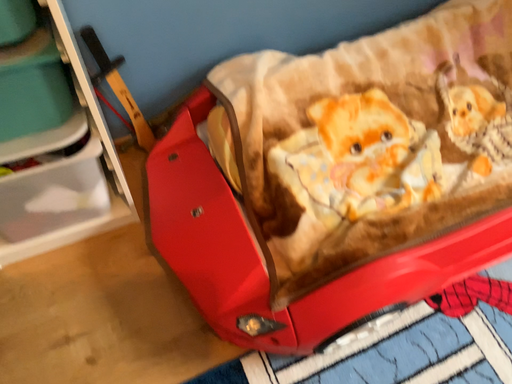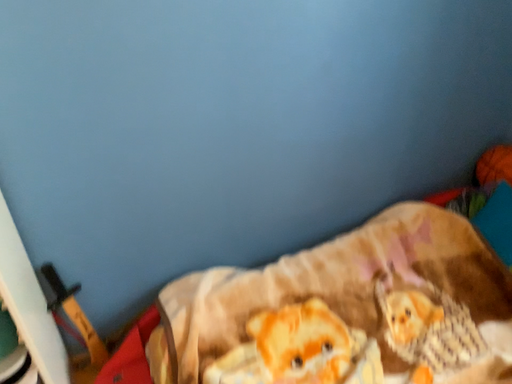
Question: How did the camera likely rotate when shooting the video?

Choices:
 (A) rotated downward
 (B) rotated upward

Answer: (B)